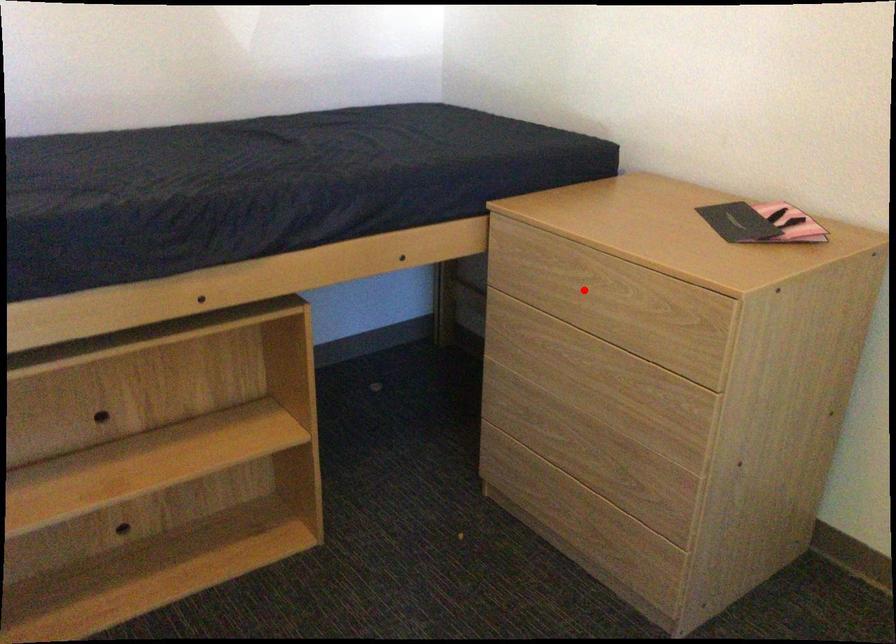
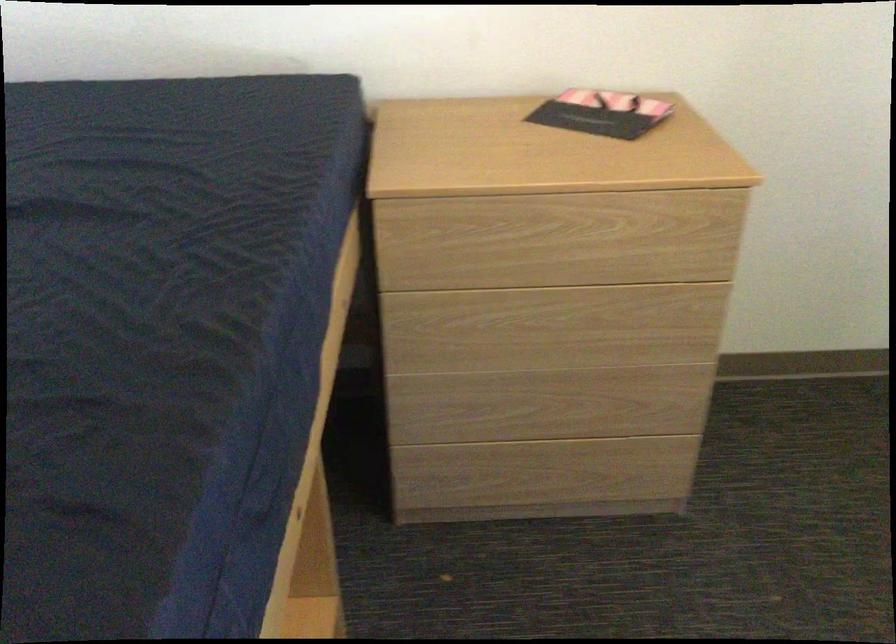
The point at the highlighted location is marked in the first image. Where is the corresponding point in the second image?

(557, 240)